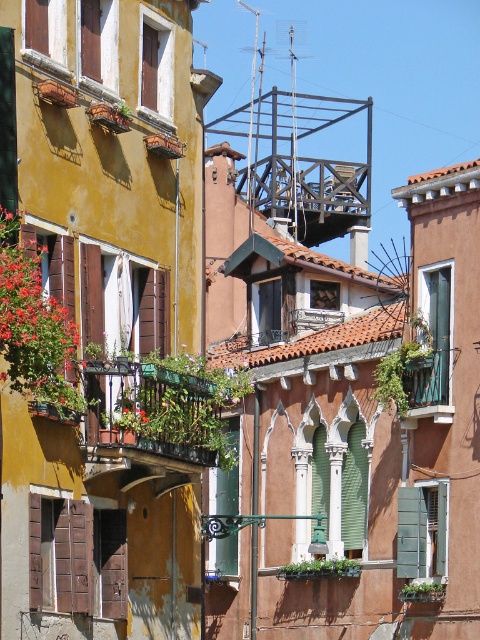
Question: Which point appears closest to the camera in this image?

Choices:
 (A) (63, 572)
 (B) (103, 400)

Answer: (A)

Question: Which point is closer to the camera?

Choices:
 (A) green metal balcony at center
 (B) brown wooden shutter at lower left

Answer: (B)

Question: Is green metal balcony at center smaller than brown wooden shutter at lower left?

Choices:
 (A) no
 (B) yes

Answer: (B)

Question: Does green metal balcony at center appear on the right side of brown wooden shutter at lower left?

Choices:
 (A) no
 (B) yes

Answer: (B)

Question: Is green metal balcony at center positioned before brown wooden shutter at lower left?

Choices:
 (A) no
 (B) yes

Answer: (A)